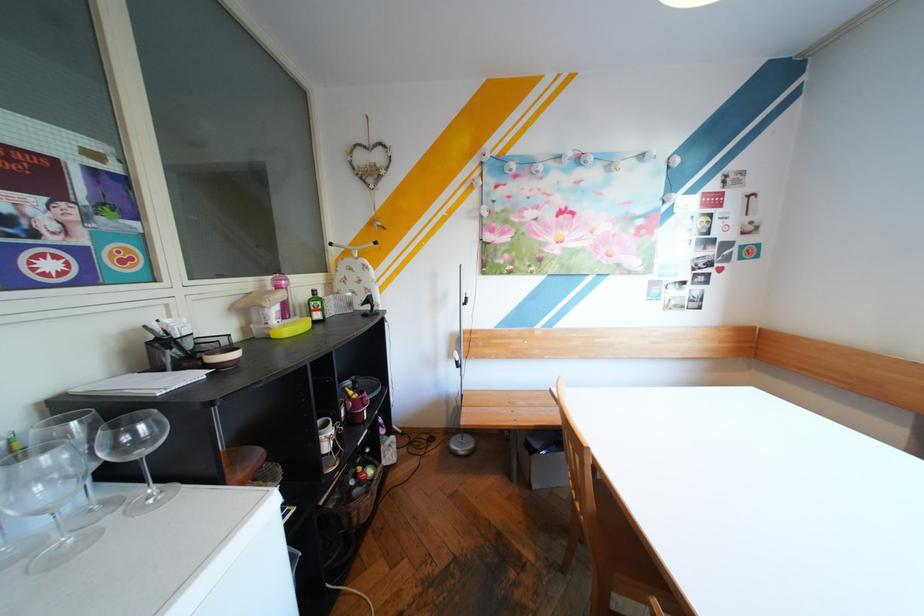
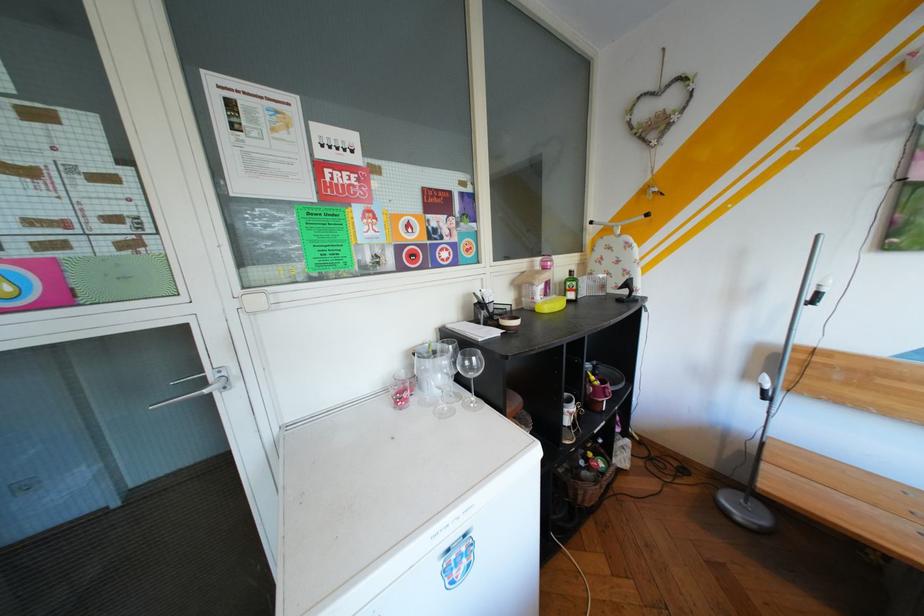
Find the pixel in the second image that matches point (367, 400) in the first image.

(608, 386)